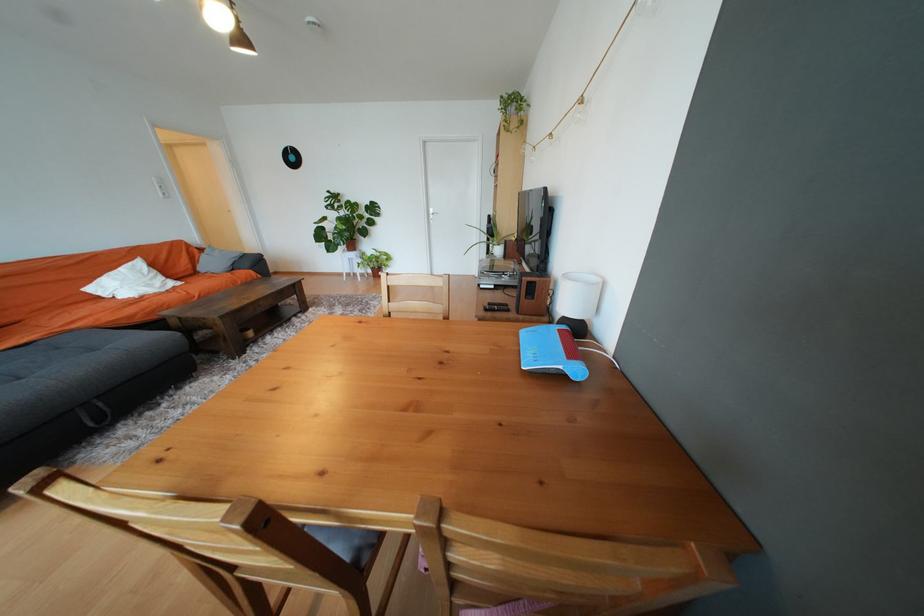
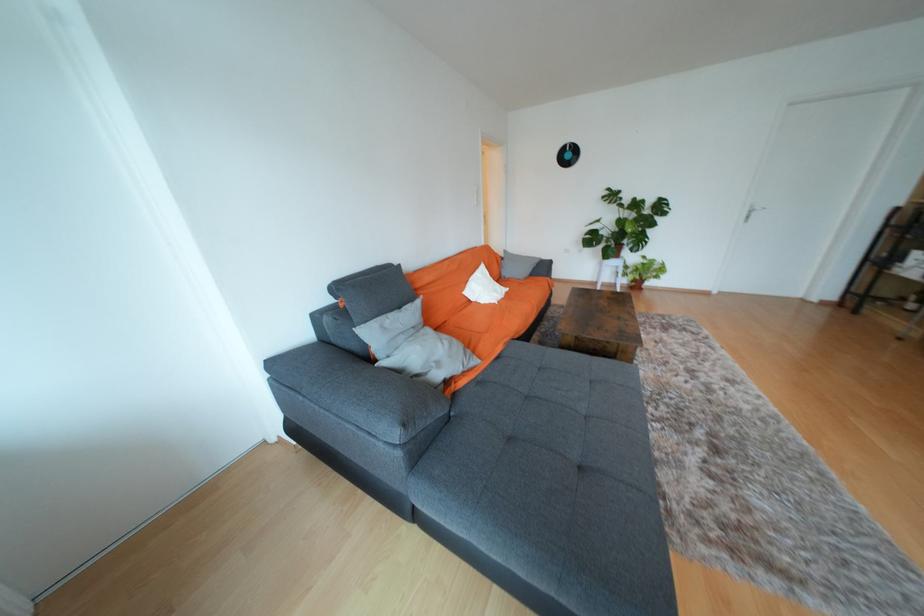
Question: In a continuous first-person perspective shot, in which direction is the camera moving?

Choices:
 (A) Left
 (B) Right
 (C) Forward
 (D) Backward

Answer: (A)